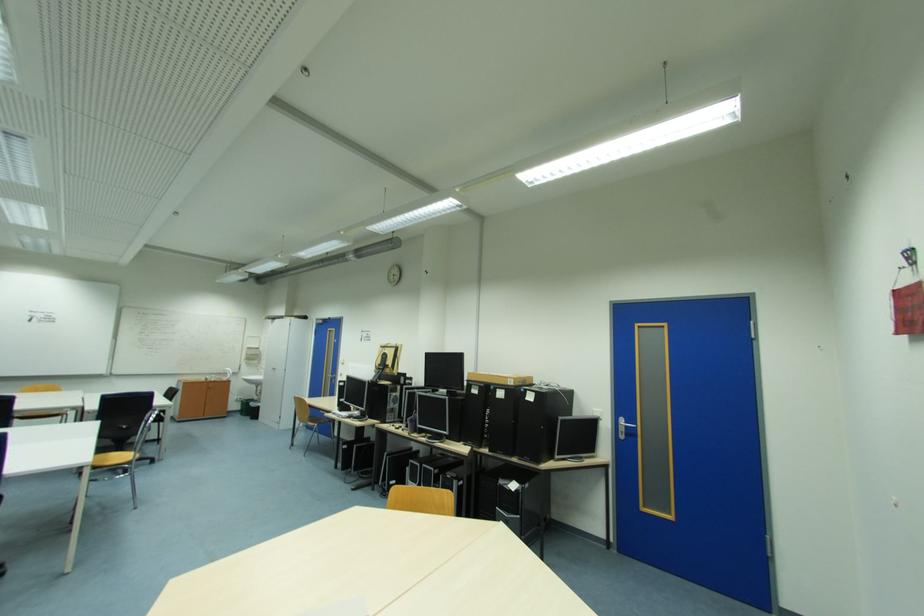
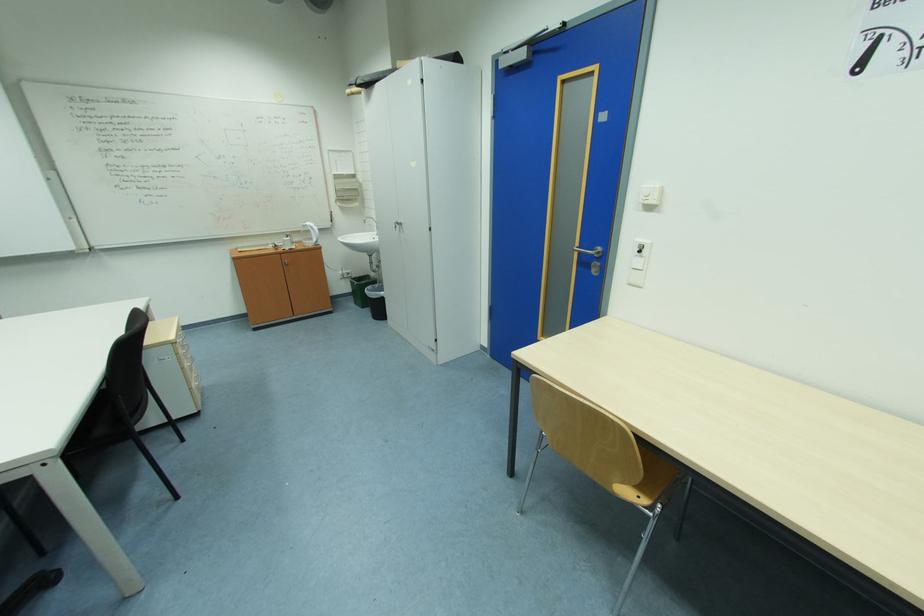
Where in the second image is the point corresponding to [249,416] from the first image?

(362, 304)